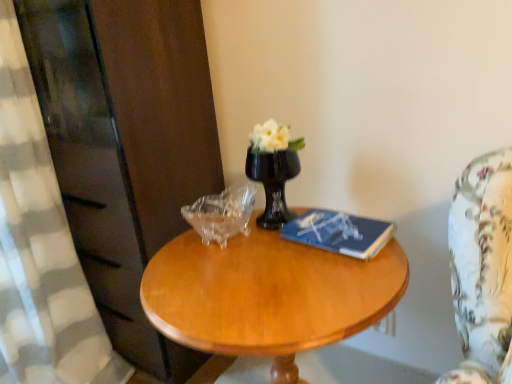
Find the location of a particular element. free space in front of black glass vase at center is located at coordinates (273, 259).